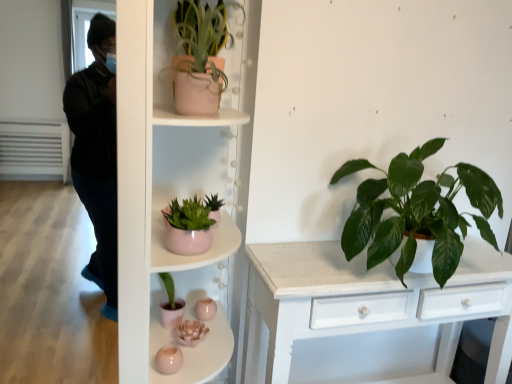
Question: Does green glossy leafy plant at right, which is counted as the 2th houseplant, starting from the left, have a greater width compared to matte pink pot at center, the 2th shelf positioned from the top?

Choices:
 (A) no
 (B) yes

Answer: (A)

Question: From a real-world perspective, is green glossy leafy plant at right, which is the 1th houseplant from bottom to top, beneath matte pink pot at center, the 2th shelf positioned from the top?

Choices:
 (A) yes
 (B) no

Answer: (B)

Question: Can you confirm if green glossy leafy plant at right, which is counted as the 2th houseplant, starting from the left, is positioned to the right of matte pink pot at center, the 2th shelf positioned from the top?

Choices:
 (A) yes
 (B) no

Answer: (A)

Question: Does green glossy leafy plant at right, which is counted as the 2th houseplant, starting from the left, turn towards matte pink pot at center, the 2th shelf positioned from the top?

Choices:
 (A) yes
 (B) no

Answer: (B)

Question: Is green glossy leafy plant at right, which is the 1th houseplant from bottom to top, facing away from matte pink pot at center, which ranks as the 1th shelf in bottom-to-top order?

Choices:
 (A) yes
 (B) no

Answer: (B)

Question: Can you confirm if green glossy leafy plant at right, placed as the 2th houseplant when sorted from top to bottom, is taller than matte pink pot at center, which ranks as the 1th shelf in bottom-to-top order?

Choices:
 (A) no
 (B) yes

Answer: (A)

Question: Is green glossy leafy plant at right, placed as the 2th houseplant when sorted from top to bottom, bigger than matte pink pot at upper center, which appears as the 1th houseplant when viewed from the left?

Choices:
 (A) yes
 (B) no

Answer: (A)

Question: From a real-world perspective, is green glossy leafy plant at right, placed as the 2th houseplant when sorted from top to bottom, physically below matte pink pot at upper center, marked as the second houseplant in a right-to-left arrangement?

Choices:
 (A) yes
 (B) no

Answer: (A)

Question: Can you confirm if green glossy leafy plant at right, the 1th houseplant in the right-to-left sequence, is positioned to the right of matte pink pot at upper center, marked as the second houseplant in a right-to-left arrangement?

Choices:
 (A) yes
 (B) no

Answer: (A)

Question: Considering the relative sizes of green glossy leafy plant at right, which is counted as the 2th houseplant, starting from the left, and matte pink pot at upper center, which is the 2th houseplant from bottom to top, in the image provided, is green glossy leafy plant at right, which is counted as the 2th houseplant, starting from the left, smaller than matte pink pot at upper center, which is the 2th houseplant from bottom to top,?

Choices:
 (A) yes
 (B) no

Answer: (B)

Question: From the image's perspective, is green glossy leafy plant at right, which is counted as the 2th houseplant, starting from the left, on matte pink pot at upper center, marked as the second houseplant in a right-to-left arrangement?

Choices:
 (A) yes
 (B) no

Answer: (B)

Question: Is green glossy leafy plant at right, which is the 1th houseplant from bottom to top, at the left side of matte pink pot at upper center, which appears as the 1th houseplant when viewed from the left?

Choices:
 (A) no
 (B) yes

Answer: (A)

Question: Is green glossy leafy plant at right, the 1th houseplant in the right-to-left sequence, at the back of matte pink pot at center, which ranks as the first shelf in top-to-bottom order?

Choices:
 (A) no
 (B) yes

Answer: (A)